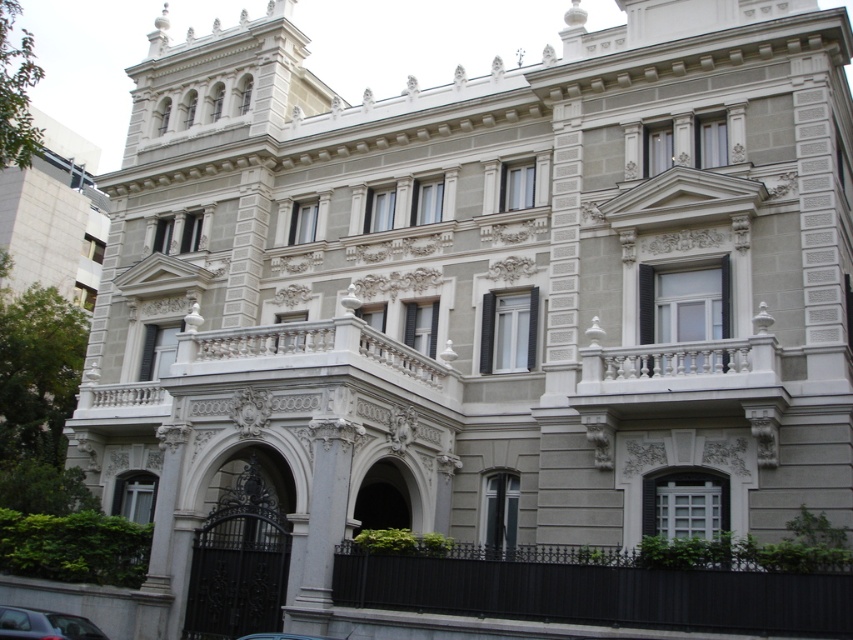
Does metallic blue car at lower left appear under metallic silver car at center?

Yes, metallic blue car at lower left is below metallic silver car at center.

Which is below, metallic blue car at lower left or metallic silver car at center?

Positioned lower is metallic blue car at lower left.

Between point (28, 625) and point (334, 637), which one is positioned behind?

The point (334, 637) is more distant.

Locate an element on the screen. Image resolution: width=853 pixels, height=640 pixels. metallic blue car at lower left is located at coordinates (44, 625).